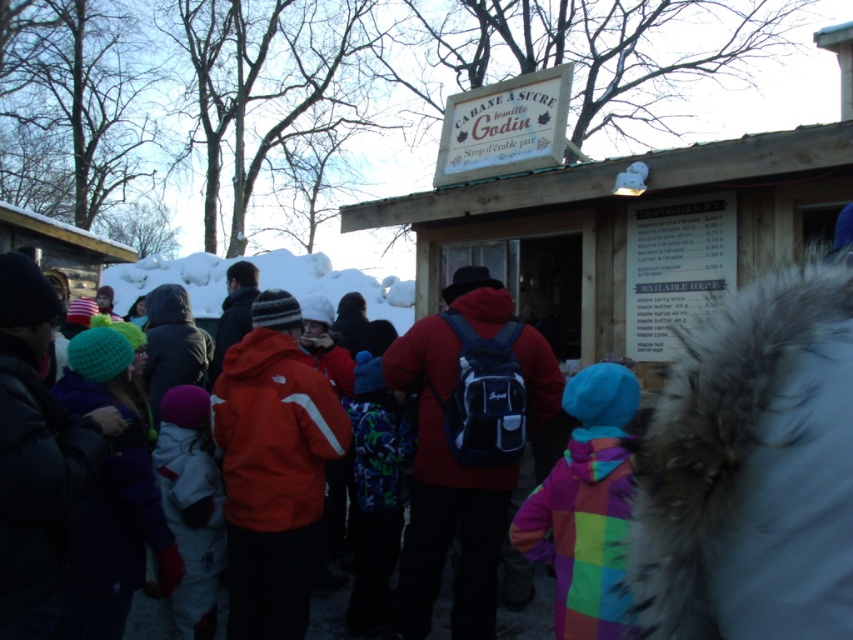
You are standing in front of the Cabane a Sucre Godin sign and want to pick up both the rainbow fleece jacket at lower right and the printed fabric backpack at center. Which item should you reach for first to grab the one closer to you?

The rainbow fleece jacket at lower right is closer to the viewer than the printed fabric backpack at center, so you should reach for the rainbow fleece jacket at lower right first.

You are planning to carry both the wooden hut at center and the printed fabric backpack at center in your car trunk. Which object should you place first into the trunk to ensure both fit properly?

Since the wooden hut at center is smaller than the printed fabric backpack at center, you should place the printed fabric backpack at center first to make space for the smaller wooden hut at center.

You are a hiker who wants to place your printed fabric backpack at center under the wooden hut at center for shelter from the snow. Can you do that?

The wooden hut at center is above the printed fabric backpack at center, so yes, you can place the printed fabric backpack at center under the wooden hut at center to shelter from the snow.